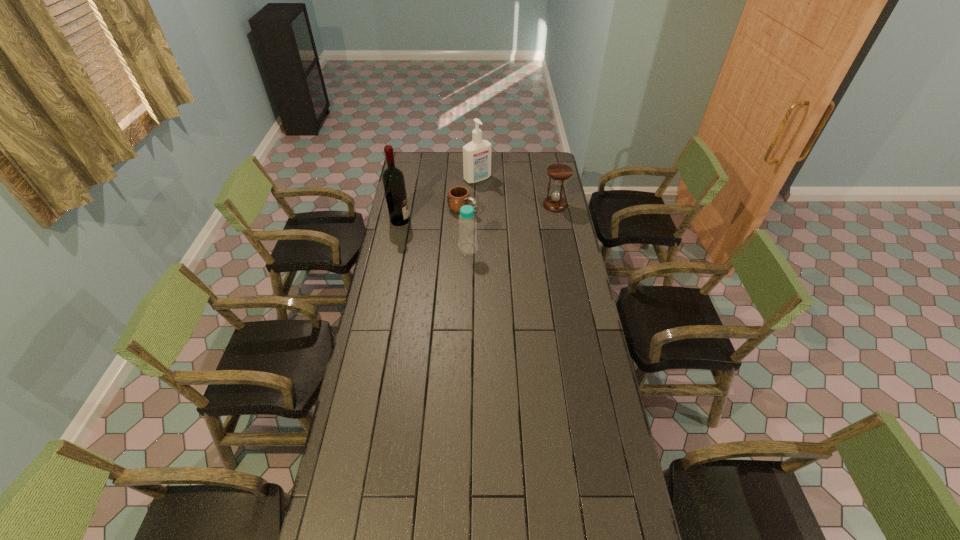
Image resolution: width=960 pixels, height=540 pixels. Identify the location of object identified as the third closest to the hourglass. (467, 224).

I want to click on object that stands as the closest to the nearest object, so click(x=459, y=196).

I want to click on vacant space that satisfies the following two spatial constraints: 1. on the back side of the second tallest object; 2. on the left side of the shortest object, so click(x=465, y=179).

Where is `vacant space that satisfies the following two spatial constraints: 1. on the front side of the hourglass; 2. on the left side of the cleansing agent`? This screenshot has height=540, width=960. vacant space that satisfies the following two spatial constraints: 1. on the front side of the hourglass; 2. on the left side of the cleansing agent is located at coordinates (477, 205).

Where is `vacant space that satisfies the following two spatial constraints: 1. on the back side of the rightmost object; 2. on the left side of the leftmost object`? Image resolution: width=960 pixels, height=540 pixels. vacant space that satisfies the following two spatial constraints: 1. on the back side of the rightmost object; 2. on the left side of the leftmost object is located at coordinates (403, 205).

At what (x,y) coordinates should I click in order to perform the action: click on free space in the image that satisfies the following two spatial constraints: 1. on the front side of the farthest object; 2. on the right side of the rightmost object. Please return your answer as a coordinate pair (x, y). The width and height of the screenshot is (960, 540). Looking at the image, I should click on (477, 205).

What are the coordinates of `vacant area in the image that satisfies the following two spatial constraints: 1. on the back side of the leftmost object; 2. on the left side of the fourth shortest object` in the screenshot? It's located at (408, 179).